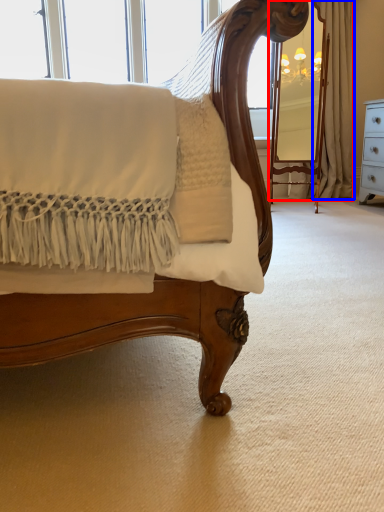
Question: Which object is further to the camera taking this photo, curtain (highlighted by a red box) or curtain (highlighted by a blue box)?

Choices:
 (A) curtain
 (B) curtain

Answer: (B)